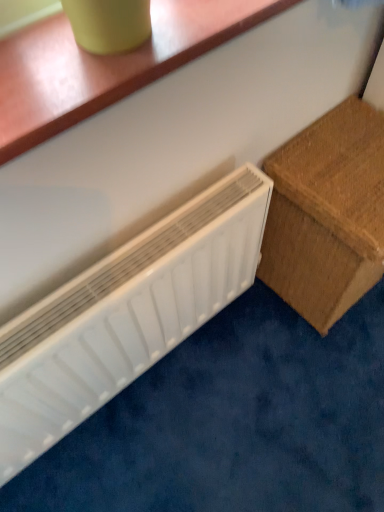
What do you see at coordinates (327, 214) in the screenshot?
I see `brown woven box at right` at bounding box center [327, 214].

The width and height of the screenshot is (384, 512). In order to click on brown woven box at right in this screenshot , I will do `click(327, 214)`.

You are a GUI agent. You are given a task and a screenshot of the screen. Output one action in this format:
    pyautogui.click(x=<x>, y=<y>)
    Task: Click on the white plastic radiator at lower left
    The image size is (384, 512).
    Given the screenshot: What is the action you would take?
    pyautogui.click(x=126, y=315)

The image size is (384, 512). Describe the element at coordinates (126, 315) in the screenshot. I see `white plastic radiator at lower left` at that location.

Locate an element on the screen. The height and width of the screenshot is (512, 384). brown woven box at right is located at coordinates (327, 214).

Considering the relative positions of brown woven box at right and white plastic radiator at lower left in the image provided, is brown woven box at right to the right of white plastic radiator at lower left from the viewer's perspective?

Yes, brown woven box at right is to the right of white plastic radiator at lower left.

Is brown woven box at right positioned in front of white plastic radiator at lower left?

No, brown woven box at right is further to the viewer.

Which point is more forward, [299,194] or [26,452]?

Positioned in front is point [26,452].

From the image's perspective, does brown woven box at right appear higher than white plastic radiator at lower left?

Yes.

From a real-world perspective, is brown woven box at right above or below white plastic radiator at lower left?

brown woven box at right is situated lower than white plastic radiator at lower left in the real world.

Looking at this image, does brown woven box at right have a lesser width compared to white plastic radiator at lower left?

No.

Is brown woven box at right taller than white plastic radiator at lower left?

No, brown woven box at right is not taller than white plastic radiator at lower left.

Looking at this image, which of these two, brown woven box at right or white plastic radiator at lower left, is smaller?

With smaller size is white plastic radiator at lower left.

Is brown woven box at right completely or partially outside of white plastic radiator at lower left?

Yes, brown woven box at right is located beyond the bounds of white plastic radiator at lower left.

Is there a large distance between brown woven box at right and white plastic radiator at lower left?

brown woven box at right is near white plastic radiator at lower left, not far away.

In the scene shown: Could you tell me if brown woven box at right is facing white plastic radiator at lower left?

No, brown woven box at right is not aimed at white plastic radiator at lower left.

Can you tell me how much brown woven box at right and white plastic radiator at lower left differ in facing direction?

3.3 degrees separate the facing orientations of brown woven box at right and white plastic radiator at lower left.

Locate an element on the screen. furniture lying on the right of white plastic radiator at lower left is located at coordinates (327, 214).

Between white plastic radiator at lower left and brown woven box at right, which one appears on the right side from the viewer's perspective?

Positioned to the right is brown woven box at right.

Is the position of white plastic radiator at lower left less distant than that of brown woven box at right?

Yes.

Considering the points (46, 428) and (344, 218), which point is behind, point (46, 428) or point (344, 218)?

Positioned behind is point (46, 428).

From the image's perspective, who appears lower, white plastic radiator at lower left or brown woven box at right?

white plastic radiator at lower left, from the image's perspective.

From a real-world perspective, which is physically above, white plastic radiator at lower left or brown woven box at right?

In real-world perspective, white plastic radiator at lower left is above.

Considering the sizes of white plastic radiator at lower left and brown woven box at right in the image, is white plastic radiator at lower left wider or thinner than brown woven box at right?

Clearly, white plastic radiator at lower left has less width compared to brown woven box at right.

In terms of height, does white plastic radiator at lower left look taller or shorter compared to brown woven box at right?

In the image, white plastic radiator at lower left appears to be taller than brown woven box at right.

Does white plastic radiator at lower left have a larger size compared to brown woven box at right?

No, white plastic radiator at lower left is not bigger than brown woven box at right.

In the scene shown: Is brown woven box at right surrounded by white plastic radiator at lower left?

No, brown woven box at right is not a part of white plastic radiator at lower left.

Is white plastic radiator at lower left far away from brown woven box at right?

No, white plastic radiator at lower left is in close proximity to brown woven box at right.

Is white plastic radiator at lower left facing towards brown woven box at right?

No, white plastic radiator at lower left is not oriented towards brown woven box at right.

How different are the orientations of white plastic radiator at lower left and brown woven box at right in degrees?

There is a 3.3-degree angle between the facing directions of white plastic radiator at lower left and brown woven box at right.

Identify the location of furniture above the white plastic radiator at lower left (from the image's perspective). Image resolution: width=384 pixels, height=512 pixels. (327, 214).

This screenshot has height=512, width=384. I want to click on furniture above the white plastic radiator at lower left (from the image's perspective), so click(327, 214).

The image size is (384, 512). In order to click on radiator on the left side of brown woven box at right in this screenshot , I will do `click(126, 315)`.